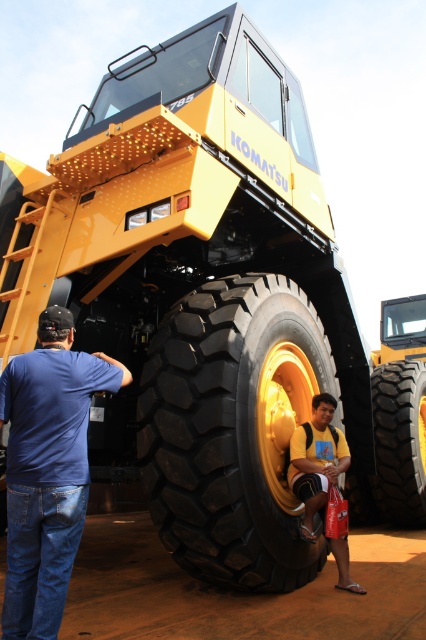
Does point (77, 404) come behind point (411, 438)?

No.

Is point (11, 486) less distant than point (405, 440)?

Yes, point (11, 486) is in front of point (405, 440).

This screenshot has width=426, height=640. What are the coordinates of `blue denim jeans at lower left` in the screenshot? It's located at (48, 468).

Between point (46, 308) and point (324, 493), which one is positioned behind?

Point (324, 493)

Which of these two, blue denim jeans at lower left or yellow cotton shirt at lower center, stands taller?

blue denim jeans at lower left is taller.

Locate an element on the screen. The height and width of the screenshot is (640, 426). blue denim jeans at lower left is located at coordinates (48, 468).

Identify the location of blue denim jeans at lower left. The image size is (426, 640). (48, 468).

From the picture: Is black rubber tire at center wider than blue denim jeans at lower left?

Correct, the width of black rubber tire at center exceeds that of blue denim jeans at lower left.

Between point (281, 467) and point (69, 556), which one is positioned in front?

Point (69, 556) is more forward.

Locate an element on the screen. The width and height of the screenshot is (426, 640). black rubber tire at center is located at coordinates (233, 428).